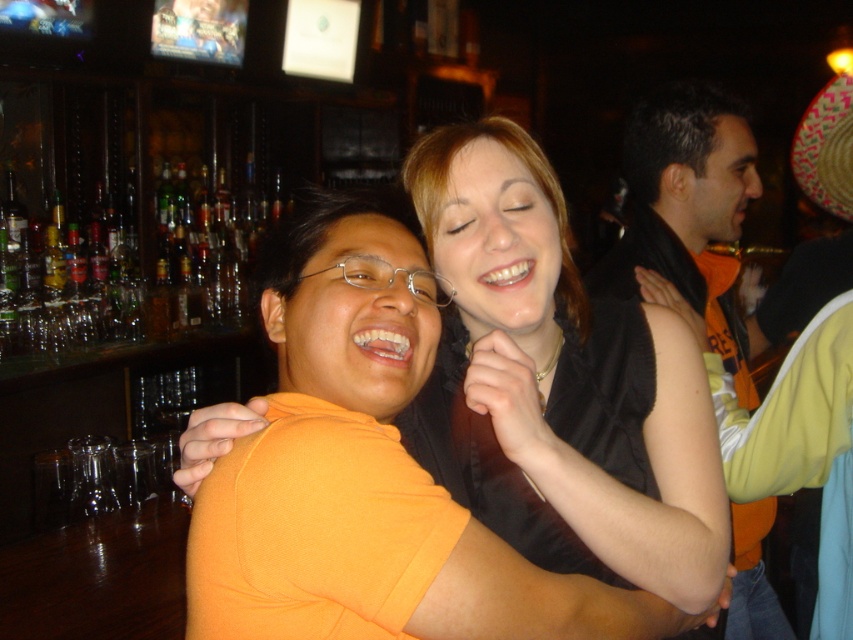
Does orange matte shirt at center come in front of patterned straw hat at upper right?

No.

I want to click on orange matte shirt at center, so (x=709, y=225).

Is point (534, 275) behind point (730, 180)?

That is False.

Does point (827, 266) lie in front of point (618, 289)?

No.

You are a GUI agent. You are given a task and a screenshot of the screen. Output one action in this format:
    pyautogui.click(x=<x>, y=<y>)
    Task: Click on the orange matte shirt at center
    The image size is (853, 640).
    Given the screenshot: What is the action you would take?
    pyautogui.click(x=709, y=225)

The height and width of the screenshot is (640, 853). What do you see at coordinates (688, 211) in the screenshot?
I see `black sleeveless shirt at right` at bounding box center [688, 211].

Can you confirm if black sleeveless shirt at right is wider than patterned straw hat at upper right?

Correct, the width of black sleeveless shirt at right exceeds that of patterned straw hat at upper right.

Where is `black sleeveless shirt at right`? black sleeveless shirt at right is located at coordinates (688, 211).